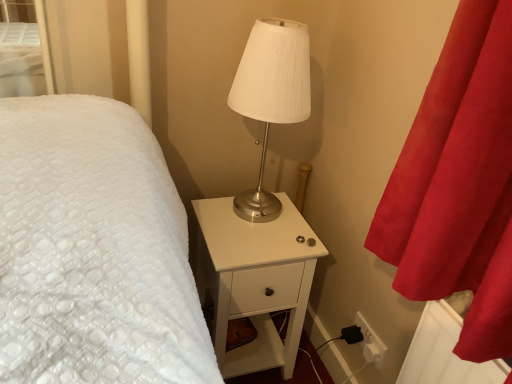
Question: Considering their positions, is white glossy nightstand at center located in front of or behind satin white lamp at center?

Choices:
 (A) behind
 (B) front

Answer: (A)

Question: Do you think white glossy nightstand at center is within satin white lamp at center, or outside of it?

Choices:
 (A) outside
 (B) inside

Answer: (A)

Question: Would you say white glossy nightstand at center is to the left or to the right of satin white lamp at center in the picture?

Choices:
 (A) left
 (B) right

Answer: (A)

Question: Is satin white lamp at center in front of or behind white glossy nightstand at center in the image?

Choices:
 (A) front
 (B) behind

Answer: (A)

Question: Considering the positions of point (266, 147) and point (290, 309), is point (266, 147) closer or farther from the camera than point (290, 309)?

Choices:
 (A) closer
 (B) farther

Answer: (B)

Question: Looking at their shapes, would you say satin white lamp at center is wider or thinner than white glossy nightstand at center?

Choices:
 (A) thin
 (B) wide

Answer: (A)

Question: In terms of height, does satin white lamp at center look taller or shorter compared to white glossy nightstand at center?

Choices:
 (A) tall
 (B) short

Answer: (B)